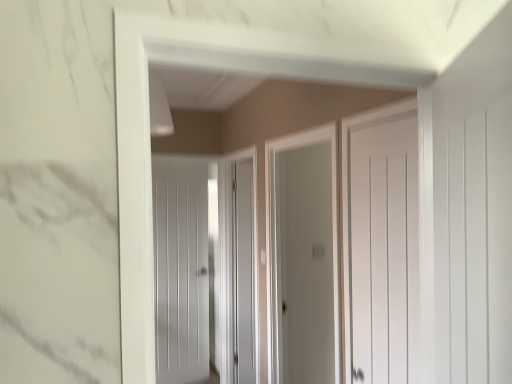
Where is `white matte door at center, marked as the first door in a right-to-left arrangement`? The height and width of the screenshot is (384, 512). white matte door at center, marked as the first door in a right-to-left arrangement is located at coordinates (383, 252).

Measure the distance between white matte door at center, which is the 1th door in front-to-back order, and camera.

The distance of white matte door at center, which is the 1th door in front-to-back order, from camera is 3.47 feet.

What is the approximate width of matte gray screen door at center, which appears as the 1th screen door when viewed from the left?

The width of matte gray screen door at center, which appears as the 1th screen door when viewed from the left, is 14.37 centimeters.

The image size is (512, 384). What do you see at coordinates (275, 236) in the screenshot?
I see `clear glass door at center, marked as the 2th screen door in a left-to-right arrangement` at bounding box center [275, 236].

Locate an element on the screen. Image resolution: width=512 pixels, height=384 pixels. white matte door at center, which is the 1th door in front-to-back order is located at coordinates (383, 252).

Is white matte door at center, acting as the second door starting from the left, oriented away from white matte door at center, the 1th door from the left?

No.

Who is shorter, white matte door at center, acting as the second door starting from the left, or white matte door at center, arranged as the second door when viewed from the front?

Standing shorter between the two is white matte door at center, acting as the second door starting from the left.

Which point is more distant from viewer, (407, 254) or (158, 325)?

Positioned behind is point (158, 325).

From the image's perspective, relative to white matte door at center, placed as the first door when sorted from back to front, is white matte door at center, acting as the second door starting from the left, above or below?

Clearly, from the image's perspective, white matte door at center, acting as the second door starting from the left, is above white matte door at center, placed as the first door when sorted from back to front.

Locate an element on the screen. The image size is (512, 384). door lying on the right of clear glass door at center, which is the first screen door from right to left is located at coordinates (383, 252).

From a real-world perspective, is clear glass door at center, acting as the 1th screen door starting from the front, located beneath white matte door at center, acting as the second door starting from the left?

Correct, in the physical world, clear glass door at center, acting as the 1th screen door starting from the front, is lower than white matte door at center, acting as the second door starting from the left.

How different are the orientations of clear glass door at center, positioned as the 2th screen door in back-to-front order, and white matte door at center, placed as the 2th door when sorted from back to front, in degrees?

0.0051 degrees.

Is the surface of clear glass door at center, positioned as the 2th screen door in back-to-front order, in direct contact with white matte door at center, which is the 1th door in front-to-back order?

No, clear glass door at center, positioned as the 2th screen door in back-to-front order, is not touching white matte door at center, which is the 1th door in front-to-back order.

From a real-world perspective, is white matte door at center, arranged as the second door when viewed from the front, located beneath matte gray screen door at center, marked as the 2th screen door in a right-to-left arrangement?

Yes.

Is white matte door at center, the 1th door from the left, placed right next to matte gray screen door at center, placed as the first screen door when sorted from back to front?

They are not placed beside each other.

Considering the positions of objects white matte door at center, the second door positioned from the right, and matte gray screen door at center, arranged as the 2th screen door when viewed from the front, in the image provided, who is more to the right, white matte door at center, the second door positioned from the right, or matte gray screen door at center, arranged as the 2th screen door when viewed from the front,?

matte gray screen door at center, arranged as the 2th screen door when viewed from the front.

Based on their sizes in the image, would you say white matte door at center, placed as the first door when sorted from back to front, is bigger or smaller than matte gray screen door at center, arranged as the 2th screen door when viewed from the front?

white matte door at center, placed as the first door when sorted from back to front, is smaller than matte gray screen door at center, arranged as the 2th screen door when viewed from the front.

Are matte gray screen door at center, arranged as the 2th screen door when viewed from the front, and white matte door at center, placed as the 2th door when sorted from back to front, beside each other?

No, matte gray screen door at center, arranged as the 2th screen door when viewed from the front, is not making contact with white matte door at center, placed as the 2th door when sorted from back to front.

Is matte gray screen door at center, marked as the 2th screen door in a right-to-left arrangement, oriented away from white matte door at center, which is the 1th door in front-to-back order?

matte gray screen door at center, marked as the 2th screen door in a right-to-left arrangement, does not have its back to white matte door at center, which is the 1th door in front-to-back order.

Considering the relative positions of matte gray screen door at center, arranged as the 2th screen door when viewed from the front, and white matte door at center, placed as the 2th door when sorted from back to front, in the image provided, is matte gray screen door at center, arranged as the 2th screen door when viewed from the front, behind white matte door at center, placed as the 2th door when sorted from back to front,?

Yes, matte gray screen door at center, arranged as the 2th screen door when viewed from the front, is further from the camera.

Does matte gray screen door at center, which appears as the 1th screen door when viewed from the left, come in front of white matte door at center, placed as the first door when sorted from back to front?

Yes, matte gray screen door at center, which appears as the 1th screen door when viewed from the left, is in front of white matte door at center, placed as the first door when sorted from back to front.

Considering the positions of points (248, 188) and (162, 200), is point (248, 188) farther from camera compared to point (162, 200)?

No, it is in front of (162, 200).

What's the angular difference between matte gray screen door at center, marked as the 2th screen door in a right-to-left arrangement, and white matte door at center, placed as the first door when sorted from back to front,'s facing directions?

90.8 degrees.

The height and width of the screenshot is (384, 512). I want to click on door that appears behind the matte gray screen door at center, arranged as the 2th screen door when viewed from the front, so pos(181,269).

Do you think white matte door at center, the second door positioned from the right, is within clear glass door at center, acting as the 1th screen door starting from the front, or outside of it?

white matte door at center, the second door positioned from the right, cannot be found inside clear glass door at center, acting as the 1th screen door starting from the front.

From a real-world perspective, is white matte door at center, the 1th door from the left, located higher than clear glass door at center, which is the first screen door from right to left?

No, from a real-world perspective, white matte door at center, the 1th door from the left, is not on top of clear glass door at center, which is the first screen door from right to left.

Considering the sizes of white matte door at center, placed as the first door when sorted from back to front, and clear glass door at center, marked as the 2th screen door in a left-to-right arrangement, in the image, is white matte door at center, placed as the first door when sorted from back to front, bigger or smaller than clear glass door at center, marked as the 2th screen door in a left-to-right arrangement,?

white matte door at center, placed as the first door when sorted from back to front, is smaller than clear glass door at center, marked as the 2th screen door in a left-to-right arrangement.

Can you confirm if white matte door at center, acting as the second door starting from the left, is shorter than clear glass door at center, which is the first screen door from right to left?

Yes, white matte door at center, acting as the second door starting from the left, is shorter than clear glass door at center, which is the first screen door from right to left.

From the image's perspective, would you say white matte door at center, which is the 1th door in front-to-back order, is positioned over clear glass door at center, positioned as the 2th screen door in back-to-front order?

Yes.

Is clear glass door at center, acting as the 1th screen door starting from the front, at the back of white matte door at center, marked as the first door in a right-to-left arrangement?

No.

Identify the location of door on the right of white matte door at center, the 1th door from the left. The width and height of the screenshot is (512, 384). (383, 252).

This screenshot has height=384, width=512. In order to click on door that appears above the clear glass door at center, positioned as the 2th screen door in back-to-front order (from a real-world perspective) in this screenshot , I will do `click(383, 252)`.

Estimate the real-world distances between objects in this image. Which object is closer to matte gray screen door at center, marked as the 2th screen door in a right-to-left arrangement, clear glass door at center, marked as the 2th screen door in a left-to-right arrangement, or white matte door at center, arranged as the second door when viewed from the front?

white matte door at center, arranged as the second door when viewed from the front, is positioned closer to the anchor matte gray screen door at center, marked as the 2th screen door in a right-to-left arrangement.

Which object lies further to the anchor point matte gray screen door at center, marked as the 2th screen door in a right-to-left arrangement, white matte door at center, the 1th door from the left, or white matte door at center, acting as the second door starting from the left?

white matte door at center, acting as the second door starting from the left, is positioned further to the anchor matte gray screen door at center, marked as the 2th screen door in a right-to-left arrangement.

Which object lies further to the anchor point clear glass door at center, which is the first screen door from right to left, white matte door at center, which is the 1th door in front-to-back order, or matte gray screen door at center, placed as the first screen door when sorted from back to front?

matte gray screen door at center, placed as the first screen door when sorted from back to front, is further to clear glass door at center, which is the first screen door from right to left.

Looking at the image, which one is located closer to white matte door at center, which is the 1th door in front-to-back order, matte gray screen door at center, arranged as the 2th screen door when viewed from the front, or clear glass door at center, positioned as the 2th screen door in back-to-front order?

clear glass door at center, positioned as the 2th screen door in back-to-front order, is positioned closer to the anchor white matte door at center, which is the 1th door in front-to-back order.

Which object lies nearer to the anchor point clear glass door at center, acting as the 1th screen door starting from the front, white matte door at center, marked as the first door in a right-to-left arrangement, or white matte door at center, arranged as the second door when viewed from the front?

white matte door at center, marked as the first door in a right-to-left arrangement.

Based on their spatial positions, is matte gray screen door at center, arranged as the 2th screen door when viewed from the front, or white matte door at center, which is the 1th door in front-to-back order, further from clear glass door at center, positioned as the 2th screen door in back-to-front order?

matte gray screen door at center, arranged as the 2th screen door when viewed from the front, lies further to clear glass door at center, positioned as the 2th screen door in back-to-front order, than the other object.

From the image, which object appears to be farther from white matte door at center, placed as the 2th door when sorted from back to front, white matte door at center, the second door positioned from the right, or matte gray screen door at center, marked as the 2th screen door in a right-to-left arrangement?

white matte door at center, the second door positioned from the right, lies further to white matte door at center, placed as the 2th door when sorted from back to front, than the other object.

When comparing their distances from clear glass door at center, positioned as the 2th screen door in back-to-front order, does matte gray screen door at center, arranged as the 2th screen door when viewed from the front, or white matte door at center, placed as the first door when sorted from back to front, seem further?

white matte door at center, placed as the first door when sorted from back to front, lies further to clear glass door at center, positioned as the 2th screen door in back-to-front order, than the other object.

Image resolution: width=512 pixels, height=384 pixels. I want to click on screen door between white matte door at center, which is the 1th door in front-to-back order, and matte gray screen door at center, marked as the 2th screen door in a right-to-left arrangement, along the z-axis, so click(275, 236).

This screenshot has height=384, width=512. What are the coordinates of `screen door positioned between clear glass door at center, marked as the 2th screen door in a left-to-right arrangement, and white matte door at center, the second door positioned from the right, from near to far` in the screenshot? It's located at (237, 263).